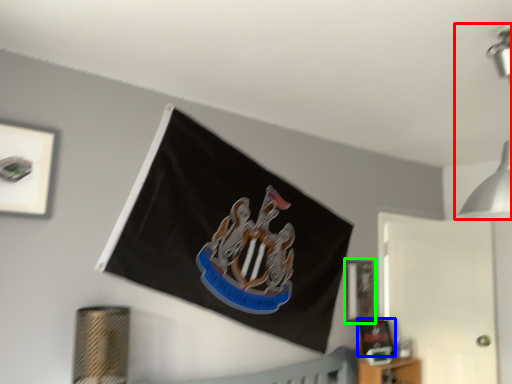
Question: Estimate the real-world distances between objects in this image. Which object is closer to light fixture (highlighted by a red box), picture frame (highlighted by a blue box) or picture frame (highlighted by a green box)?

Choices:
 (A) picture frame
 (B) picture frame

Answer: (B)